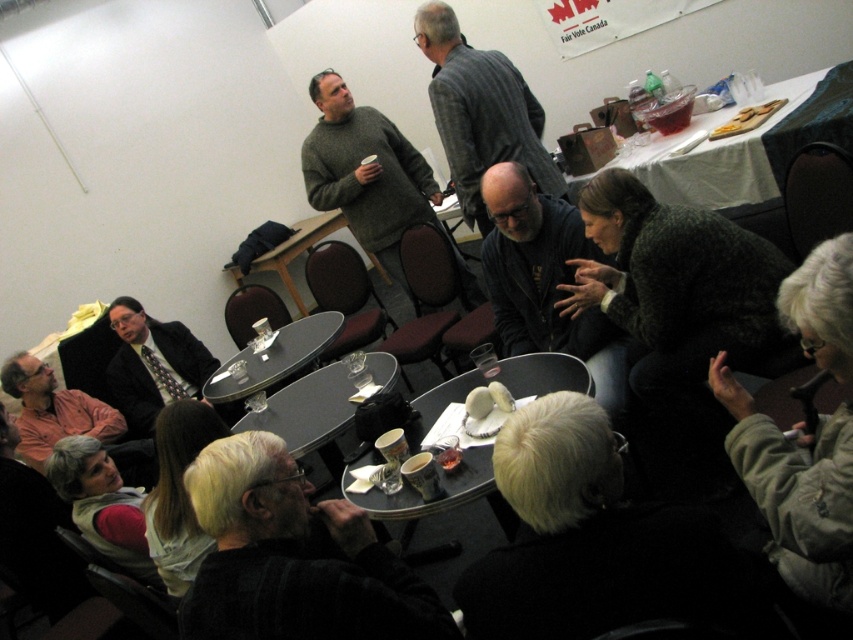
Question: Estimate the real-world distances between objects in this image. Which object is farther from the dark gray sweater at center?

Choices:
 (A) matte orange shirt at lower left
 (B) matte black tray at center
 (C) dark suit at left

Answer: (A)

Question: Does gray wool sweater at center appear over black glossy table at center?

Choices:
 (A) yes
 (B) no

Answer: (A)

Question: Can you confirm if white cloth-covered table at upper right is positioned above black glass table at center?

Choices:
 (A) no
 (B) yes

Answer: (B)

Question: Is dark gray sweater at center to the right of gray wool sweater at center from the viewer's perspective?

Choices:
 (A) no
 (B) yes

Answer: (B)

Question: Which point is closer to the camera?

Choices:
 (A) (294, 529)
 (B) (426, 396)

Answer: (A)

Question: Estimate the real-world distances between objects in this image. Which object is closer to the gray wool sweater at center?

Choices:
 (A) dark gray sweater at center
 (B) matte black tray at center
 (C) black glossy table at center
 (D) matte orange shirt at lower left

Answer: (A)